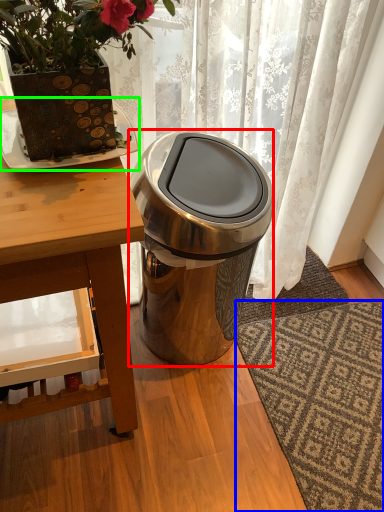
Question: Which object is the closest to the trash bin/can (highlighted by a red box)? Choose among these: doormat (highlighted by a blue box) or plate (highlighted by a green box).

Choices:
 (A) doormat
 (B) plate

Answer: (B)